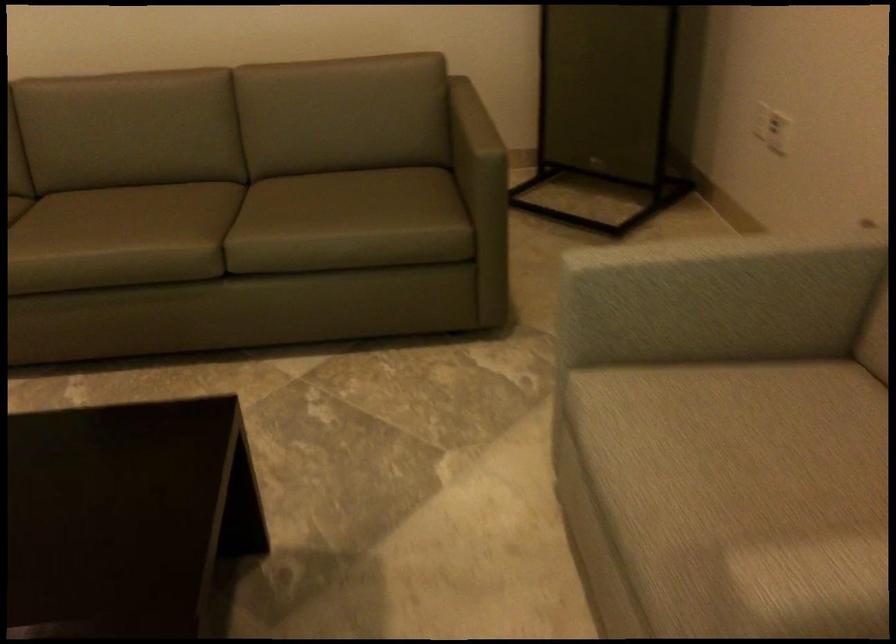
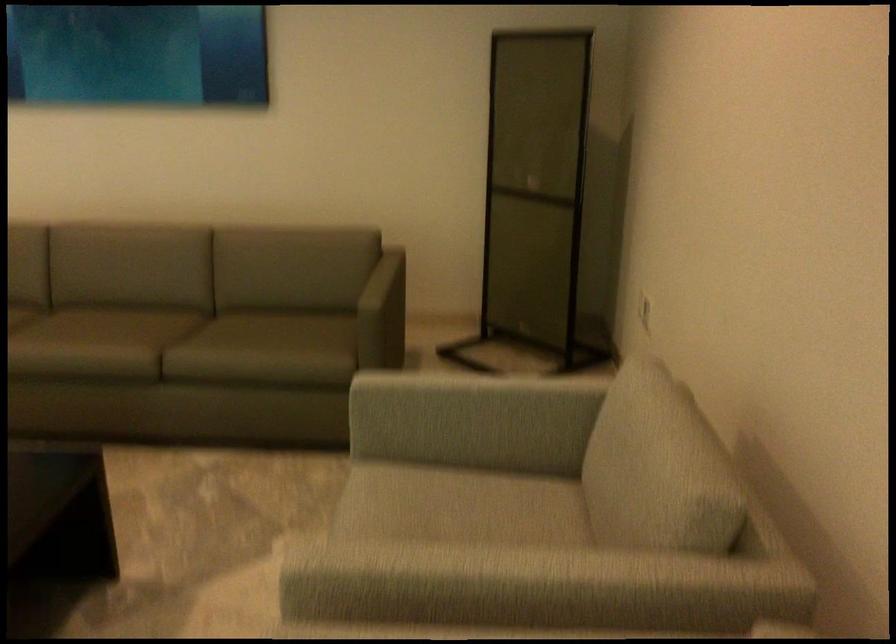
The point at (737, 277) is marked in the first image. Where is the corresponding point in the second image?

(469, 399)